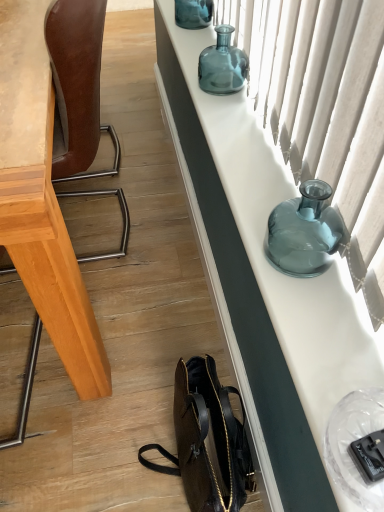
At what (x,y) coordinates should I click in order to perform the action: click on vacant area that is situated to the right of brown leather chair at left. Please return your answer as a coordinate pair (x, y). This screenshot has height=512, width=384. Looking at the image, I should click on (173, 234).